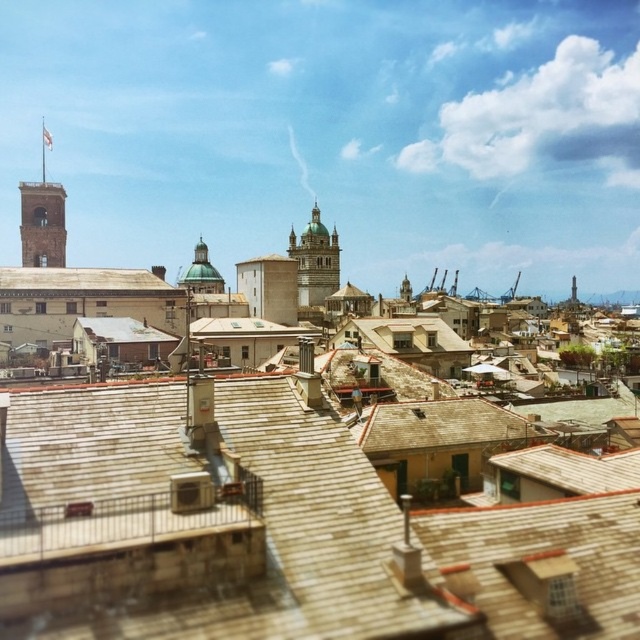
You are standing on a rooftop overlooking the city and want to take a photo of the brown shingles at center and the brick bell tower at left. Which object will appear larger in your photo?

The brown shingles at center will appear larger in the photo because they are closer to the viewer than the brick bell tower at left.

You are a photographer standing in the city and want to capture both the brown shingles at center and the brick bell tower at left in a single shot. Based on their positions, which object should you position closer to the left side of your camera frame?

The brick bell tower at left should be positioned closer to the left side of the camera frame since it is located to the left of the brown shingles at center.

You are a drone operator trying to deliver a package to a rooftop in the city. The coordinates for the delivery are point (81, 280). Which rooftop feature at those coordinates should you aim for?

The brown shingles at center is located at point (81, 280), so you should aim for the brown shingles at center.